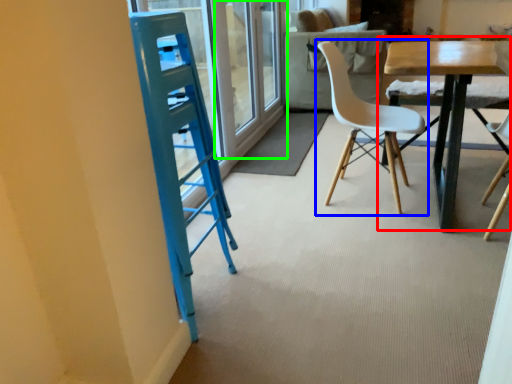
Question: Which object is the farthest from table (highlighted by a red box)? Choose among these: chair (highlighted by a blue box) or screen door (highlighted by a green box).

Choices:
 (A) chair
 (B) screen door

Answer: (B)